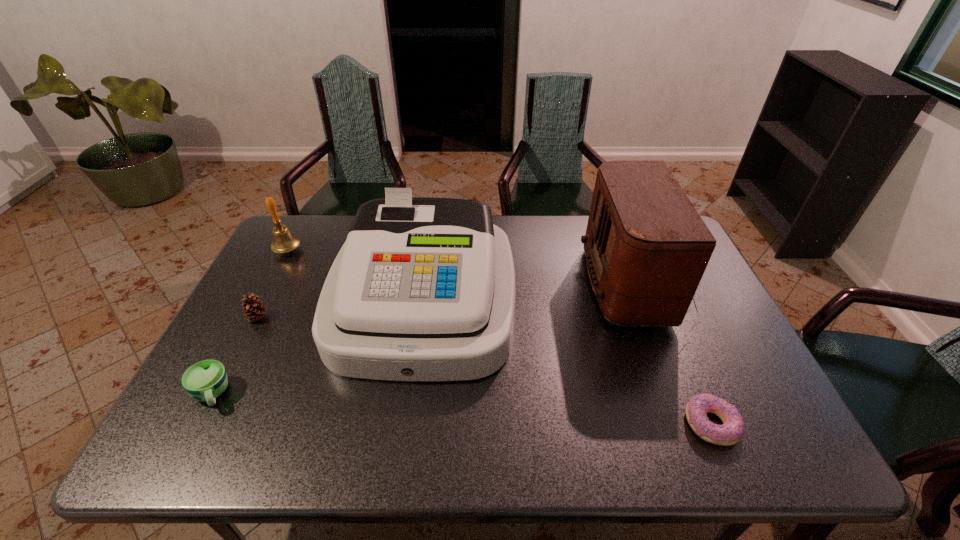
Locate an element on the screen. vacant area between the radio receiver and the doughnut is located at coordinates (676, 354).

Locate an element on the screen. This screenshot has width=960, height=540. free spot between the fourth tallest object and the fourth shortest object is located at coordinates (273, 284).

Image resolution: width=960 pixels, height=540 pixels. I want to click on vacant region between the shortest object and the radio receiver, so click(676, 354).

The image size is (960, 540). I want to click on empty space between the shortest object and the radio receiver, so click(x=676, y=354).

The width and height of the screenshot is (960, 540). Identify the location of free spot between the cup and the pinecone. (234, 356).

I want to click on free space between the cup and the pinecone, so click(234, 356).

Identify the location of object that is the second nearest to the cash register. (254, 310).

Identify the location of object that is the third closest to the doughnut. The width and height of the screenshot is (960, 540). (205, 380).

The height and width of the screenshot is (540, 960). I want to click on blank area in the image that satisfies the following two spatial constraints: 1. on the back side of the pinecone; 2. on the right side of the cup, so click(x=252, y=318).

Image resolution: width=960 pixels, height=540 pixels. I want to click on vacant space that satisfies the following two spatial constraints: 1. on the front panel of the doughnut; 2. on the right side of the radio receiver, so click(698, 424).